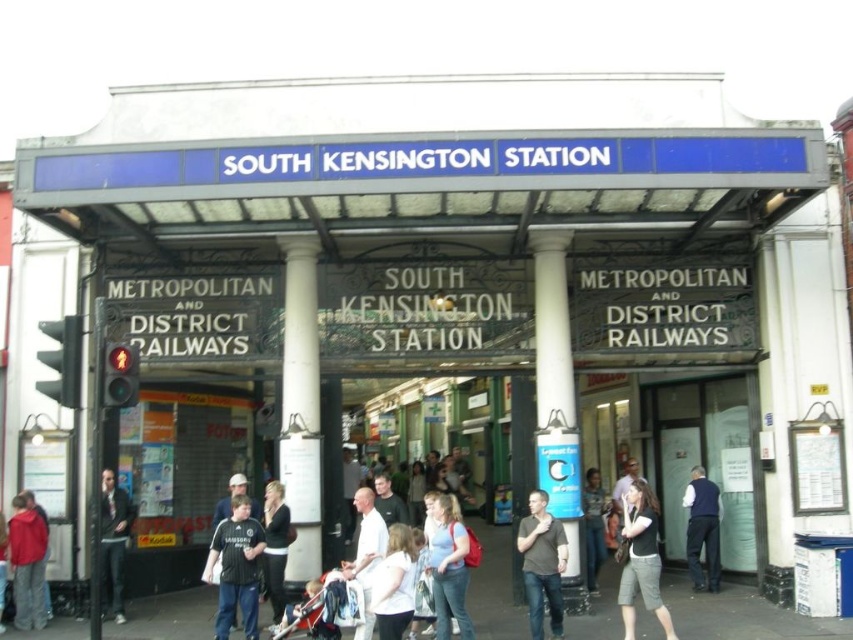
You are a person standing at the entrance of South Kensington Station. You see a transparent glass door at center and a black fabric shirt at center. Which object is bigger in size?

The transparent glass door at center has a larger size compared to the black fabric shirt at center, so the transparent glass door at center is bigger.

You are a photographer standing at the entrance of South Kensington Station. You want to take a photo of the white marble pillar at center and the light brown leather jacket at center. Based on their positions, which object should you frame first in your camera viewfinder to ensure both are in the shot?

The white marble pillar at center is to the left of the light brown leather jacket at center, so you should frame the white marble pillar at center first to ensure both are included in the shot.

You are a person standing at the entrance of South Kensington Station. You see a transparent glass door at center and a white matte shirt at center. Which object is more to the left?

The white matte shirt at center is more to the left because the transparent glass door at center is positioned on the right side of it.